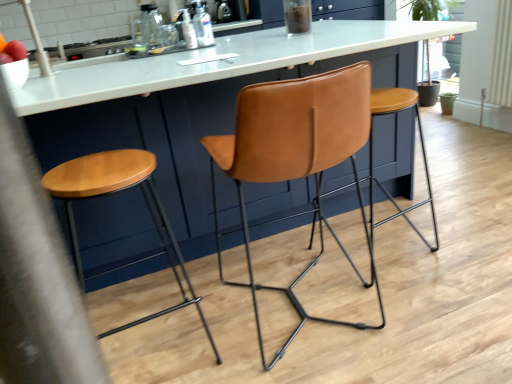
I want to click on free spot below cognac leather chair at center (from a real-world perspective), so click(x=304, y=311).